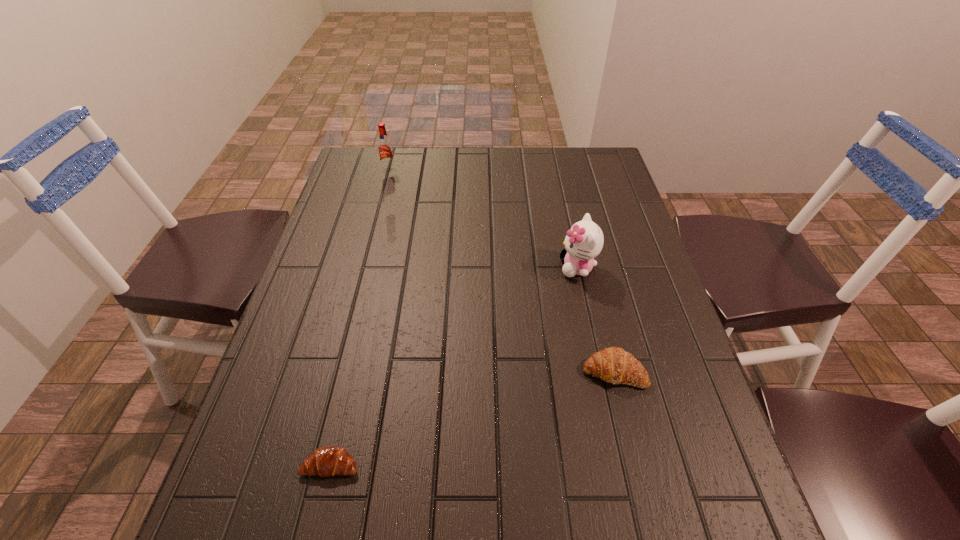
This screenshot has width=960, height=540. Find the location of `the farthest object`. the farthest object is located at coordinates (385, 149).

Where is `the second farthest object`? This screenshot has width=960, height=540. the second farthest object is located at coordinates (584, 241).

Locate an element on the screen. Image resolution: width=960 pixels, height=540 pixels. the right crescent roll is located at coordinates (613, 365).

Image resolution: width=960 pixels, height=540 pixels. In order to click on the farther crescent roll in this screenshot , I will do `click(613, 365)`.

The height and width of the screenshot is (540, 960). In order to click on the nearest object in this screenshot , I will do `click(326, 461)`.

The image size is (960, 540). I want to click on the left crescent roll, so click(326, 461).

The width and height of the screenshot is (960, 540). In order to click on free location located 0.060m on the back of the root beer in this screenshot , I will do `click(393, 157)`.

Image resolution: width=960 pixels, height=540 pixels. What are the coordinates of `vacant region located on the front-facing side of the third nearest object` in the screenshot? It's located at (415, 267).

Locate an element on the screen. This screenshot has height=540, width=960. vacant region located 0.160m on the front-facing side of the third nearest object is located at coordinates (498, 267).

Image resolution: width=960 pixels, height=540 pixels. What are the coordinates of `vacant area situated 0.380m on the front-facing side of the third nearest object` in the screenshot? It's located at (415, 267).